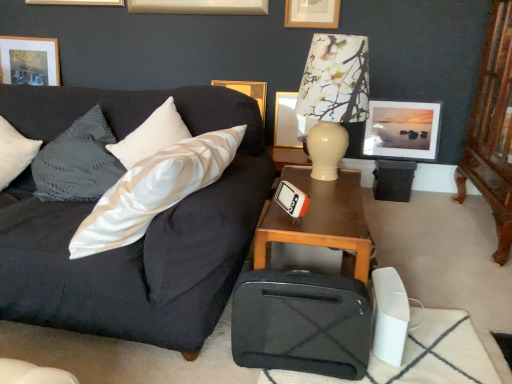
Describe the element at coordinates (154, 190) in the screenshot. I see `white satin pillow at center` at that location.

This screenshot has width=512, height=384. I want to click on white satin pillow at center, so click(x=154, y=190).

This screenshot has width=512, height=384. What do you see at coordinates (145, 234) in the screenshot? I see `dark gray fabric couch at left` at bounding box center [145, 234].

Find the location of a particular element. The image size is (512, 384). white satin pillow at center is located at coordinates (154, 190).

Does matte gold picture frame at upper center, which is the third picture frame in left-to-right order, appear on the right side of white satin pillow at center?

Yes.

Identify the location of pillow above the matte gold picture frame at upper center, the 3th picture frame when ordered from right to left (from a real-world perspective). (154, 190).

Is matte gold picture frame at upper center, the 3th picture frame when ordered from right to left, thinner than white satin pillow at center?

Correct, the width of matte gold picture frame at upper center, the 3th picture frame when ordered from right to left, is less than that of white satin pillow at center.

Are white satin pillow at center and brown wooden table at center located far from each other?

No, white satin pillow at center is in close proximity to brown wooden table at center.

Is white satin pillow at center facing towards brown wooden table at center?

No, white satin pillow at center does not turn towards brown wooden table at center.

Find the location of a particular element. pillow above the brown wooden table at center (from the image's perspective) is located at coordinates (154, 190).

From a real-world perspective, is white satin pillow at center on top of brown wooden table at center?

Yes, from a real-world perspective, white satin pillow at center is above brown wooden table at center.

Relative to matte gold picture frame at upper left, which is the fifth picture frame from right to left, is white satin pillow at center in front or behind?

In the image, white satin pillow at center appears in front of matte gold picture frame at upper left, which is the fifth picture frame from right to left.

Could you tell me if white satin pillow at center is facing matte gold picture frame at upper left, positioned as the 1th picture frame in left-to-right order?

No, white satin pillow at center is not turned towards matte gold picture frame at upper left, positioned as the 1th picture frame in left-to-right order.

Which is farther, [167,156] or [53,60]?

The point [53,60] is behind.

Would you say white satin pillow at center is outside matte gold picture frame at upper left, positioned as the 1th picture frame in left-to-right order?

That's correct, white satin pillow at center is outside of matte gold picture frame at upper left, positioned as the 1th picture frame in left-to-right order.

Where is `the 1st picture frame in front when counting from the matte gold picture frame at upper left, positioned as the 1th picture frame in left-to-right order`? The height and width of the screenshot is (384, 512). the 1st picture frame in front when counting from the matte gold picture frame at upper left, positioned as the 1th picture frame in left-to-right order is located at coordinates (248, 91).

Who is shorter, matte gold picture frame at upper left, which is the fifth picture frame from right to left, or gold metallic picture frame at upper center, the second picture frame in the left-to-right sequence?

With less height is matte gold picture frame at upper left, which is the fifth picture frame from right to left.

Is matte gold picture frame at upper left, positioned as the 1th picture frame in left-to-right order, outside of gold metallic picture frame at upper center, the second picture frame in the left-to-right sequence?

Yes, matte gold picture frame at upper left, positioned as the 1th picture frame in left-to-right order, is not within gold metallic picture frame at upper center, the second picture frame in the left-to-right sequence.

Considering the sizes of matte gold picture frame at upper left, positioned as the 1th picture frame in left-to-right order, and gold metallic picture frame at upper center, positioned as the 4th picture frame in right-to-left order, in the image, is matte gold picture frame at upper left, positioned as the 1th picture frame in left-to-right order, wider or thinner than gold metallic picture frame at upper center, positioned as the 4th picture frame in right-to-left order,?

Considering their sizes, matte gold picture frame at upper left, positioned as the 1th picture frame in left-to-right order, looks slimmer than gold metallic picture frame at upper center, positioned as the 4th picture frame in right-to-left order.

The height and width of the screenshot is (384, 512). I want to click on picture frame that is the 3rd one above the brown wooden table at center (from a real-world perspective), so click(x=248, y=91).

Looking at this image, from a real-world perspective, relative to gold metallic picture frame at upper center, the second picture frame in the left-to-right sequence, is brown wooden table at center vertically above or below?

Clearly, from a real-world perspective, brown wooden table at center is below gold metallic picture frame at upper center, the second picture frame in the left-to-right sequence.

Can you see brown wooden table at center touching gold metallic picture frame at upper center, the second picture frame in the left-to-right sequence?

No, brown wooden table at center is not next to gold metallic picture frame at upper center, the second picture frame in the left-to-right sequence.

I want to click on picture frame that is the 1st object above the matte gold picture frame at upper center, which is the third picture frame in left-to-right order (from a real-world perspective), so click(248, 91).

From the picture: From the image's perspective, is matte gold picture frame at upper center, the 3th picture frame when ordered from right to left, positioned above or below gold metallic picture frame at upper center, positioned as the 4th picture frame in right-to-left order?

matte gold picture frame at upper center, the 3th picture frame when ordered from right to left, is situated lower than gold metallic picture frame at upper center, positioned as the 4th picture frame in right-to-left order, in the image.

Is matte gold picture frame at upper center, the 3th picture frame when ordered from right to left, to the left of gold metallic picture frame at upper center, positioned as the 4th picture frame in right-to-left order, from the viewer's perspective?

No, matte gold picture frame at upper center, the 3th picture frame when ordered from right to left, is not to the left of gold metallic picture frame at upper center, positioned as the 4th picture frame in right-to-left order.

Is matte gold picture frame at upper center, the 3th picture frame when ordered from right to left, touching gold metallic picture frame at upper center, positioned as the 4th picture frame in right-to-left order?

No, matte gold picture frame at upper center, the 3th picture frame when ordered from right to left, is not beside gold metallic picture frame at upper center, positioned as the 4th picture frame in right-to-left order.

Is matte gold picture frame at upper center, which appears as the 2th picture frame when viewed from the right, oriented towards matte gold picture frame at upper center, which is the third picture frame in left-to-right order?

No, matte gold picture frame at upper center, which appears as the 2th picture frame when viewed from the right, does not turn towards matte gold picture frame at upper center, which is the third picture frame in left-to-right order.

Would you say matte gold picture frame at upper center, which ranks as the fourth picture frame in left-to-right order, is inside or outside matte gold picture frame at upper center, the 3th picture frame when ordered from right to left?

The correct answer is: outside.

Between matte gold picture frame at upper center, which appears as the 2th picture frame when viewed from the right, and matte gold picture frame at upper center, which is the third picture frame in left-to-right order, which one has smaller width?

matte gold picture frame at upper center, which appears as the 2th picture frame when viewed from the right, is thinner.

Is point (290, 19) closer or farther from the camera than point (298, 125)?

Point (290, 19).

What are the coordinates of `pillow above the matte gold picture frame at upper center, which is the third picture frame in left-to-right order (from a real-world perspective)` in the screenshot? It's located at (154, 190).

Find the location of a particular element. This screenshot has width=512, height=384. table below the white satin pillow at center (from a real-world perspective) is located at coordinates (320, 218).

Considering their positions, is gold metallic picture frame at upper center, positioned as the 4th picture frame in right-to-left order, positioned closer to wooden carved dresser at right than matte glass picture frame at upper right, positioned as the 5th picture frame in left-to-right order?

matte glass picture frame at upper right, positioned as the 5th picture frame in left-to-right order, lies closer to wooden carved dresser at right than the other object.

Estimate the real-world distances between objects in this image. Which object is further from matte glass picture frame at upper right, positioned as the 5th picture frame in left-to-right order, dark gray fabric couch at left or matte gold picture frame at upper center, which is the third picture frame in left-to-right order?

dark gray fabric couch at left is positioned further to the anchor matte glass picture frame at upper right, positioned as the 5th picture frame in left-to-right order.

Based on their spatial positions, is matte gold picture frame at upper center, which appears as the 2th picture frame when viewed from the right, or matte cream lampshade at upper right further from white satin pillow at center?

matte gold picture frame at upper center, which appears as the 2th picture frame when viewed from the right, lies further to white satin pillow at center than the other object.

From the image, which object appears to be nearer to white satin pillow at center, matte glass picture frame at upper right, the first picture frame positioned from the right, or gold metallic picture frame at upper center, positioned as the 4th picture frame in right-to-left order?

gold metallic picture frame at upper center, positioned as the 4th picture frame in right-to-left order, lies closer to white satin pillow at center than the other object.

Looking at the image, which one is located closer to gold metallic picture frame at upper center, positioned as the 4th picture frame in right-to-left order, matte cream lampshade at upper right or wooden carved dresser at right?

matte cream lampshade at upper right is positioned closer to the anchor gold metallic picture frame at upper center, positioned as the 4th picture frame in right-to-left order.

Looking at the image, which one is located further to dark gray fabric couch at left, matte gold picture frame at upper center, the 3th picture frame when ordered from right to left, or black matte suitcase at lower center?

The object further to dark gray fabric couch at left is matte gold picture frame at upper center, the 3th picture frame when ordered from right to left.

From the picture: Based on their spatial positions, is white satin pillow at center or gold metallic picture frame at upper center, positioned as the 4th picture frame in right-to-left order, further from wooden carved dresser at right?

The object further to wooden carved dresser at right is white satin pillow at center.

Which object lies nearer to the anchor point white satin pillow at center, matte gold picture frame at upper left, which is the fifth picture frame from right to left, or wooden carved dresser at right?

Based on the image, wooden carved dresser at right appears to be nearer to white satin pillow at center.

Where is `table lamp between white satin pillow at center and matte gold picture frame at upper center, the 3th picture frame when ordered from right to left, along the z-axis`? table lamp between white satin pillow at center and matte gold picture frame at upper center, the 3th picture frame when ordered from right to left, along the z-axis is located at coordinates (333, 97).

At what (x,y) coordinates should I click in order to perform the action: click on pillow located between matte gold picture frame at upper left, positioned as the 1th picture frame in left-to-right order, and matte gold picture frame at upper center, which ranks as the fourth picture frame in left-to-right order, in the left-right direction. Please return your answer as a coordinate pair (x, y). The height and width of the screenshot is (384, 512). Looking at the image, I should click on (154, 190).

This screenshot has height=384, width=512. Find the location of `dresser between matte cream lampshade at upper right and matte glass picture frame at upper right, positioned as the 5th picture frame in left-to-right order, along the z-axis`. dresser between matte cream lampshade at upper right and matte glass picture frame at upper right, positioned as the 5th picture frame in left-to-right order, along the z-axis is located at coordinates (492, 129).

Locate an element on the screen. The width and height of the screenshot is (512, 384). luggage situated between matte gold picture frame at upper left, which is the fifth picture frame from right to left, and matte gold picture frame at upper center, which ranks as the fourth picture frame in left-to-right order, from left to right is located at coordinates (301, 323).